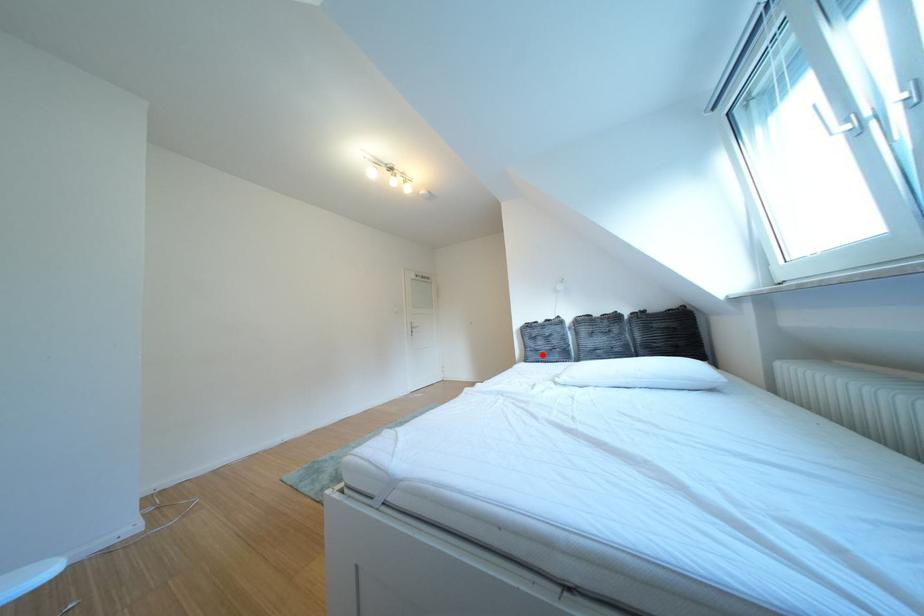
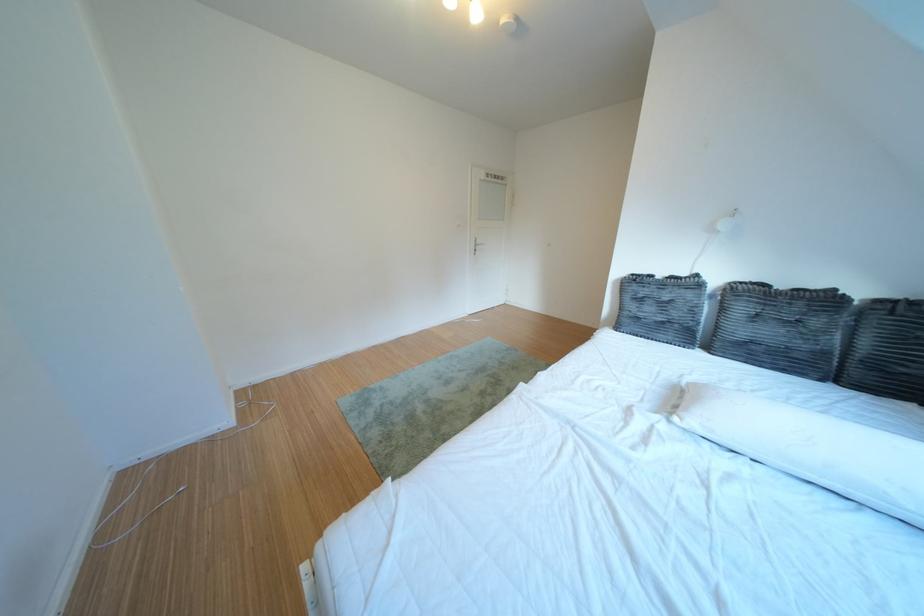
Question: I am providing you with two images of the same scene from different viewpoints. In image1, a red point is highlighted. Considering the same 3D point in image2, which of the following is correct?

Choices:
 (A) It is closer
 (B) It is farther

Answer: (A)